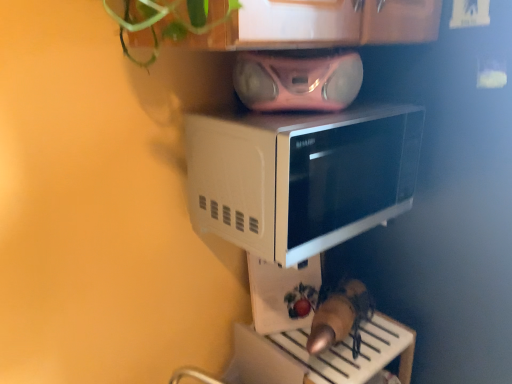
Question: Is pink metallic stereo at upper center at the back of white glossy microwave at center?

Choices:
 (A) yes
 (B) no

Answer: (B)

Question: Does white glossy microwave at center touch pink metallic stereo at upper center?

Choices:
 (A) no
 (B) yes

Answer: (A)

Question: Could you tell me if white glossy microwave at center is turned towards pink metallic stereo at upper center?

Choices:
 (A) yes
 (B) no

Answer: (B)

Question: Is white glossy microwave at center wider than pink metallic stereo at upper center?

Choices:
 (A) no
 (B) yes

Answer: (A)

Question: Does white glossy microwave at center appear on the left side of pink metallic stereo at upper center?

Choices:
 (A) no
 (B) yes

Answer: (B)

Question: Considering the relative sizes of white glossy microwave at center and pink metallic stereo at upper center in the image provided, is white glossy microwave at center bigger than pink metallic stereo at upper center?

Choices:
 (A) yes
 (B) no

Answer: (A)

Question: Considering the relative sizes of white glossy microwave at center and white glossy microwave at upper center in the image provided, is white glossy microwave at center thinner than white glossy microwave at upper center?

Choices:
 (A) no
 (B) yes

Answer: (B)

Question: Does white glossy microwave at center appear on the left side of white glossy microwave at upper center?

Choices:
 (A) no
 (B) yes

Answer: (B)

Question: From a real-world perspective, is white glossy microwave at center on white glossy microwave at upper center?

Choices:
 (A) yes
 (B) no

Answer: (B)

Question: From a real-world perspective, does white glossy microwave at center sit lower than white glossy microwave at upper center?

Choices:
 (A) no
 (B) yes

Answer: (B)

Question: Can you confirm if white glossy microwave at center is positioned to the right of white glossy microwave at upper center?

Choices:
 (A) no
 (B) yes

Answer: (A)

Question: From the image's perspective, does white glossy microwave at center appear higher than white glossy microwave at upper center?

Choices:
 (A) no
 (B) yes

Answer: (A)

Question: From the image's perspective, is white glossy microwave at upper center located beneath white glossy microwave at center?

Choices:
 (A) no
 (B) yes

Answer: (A)